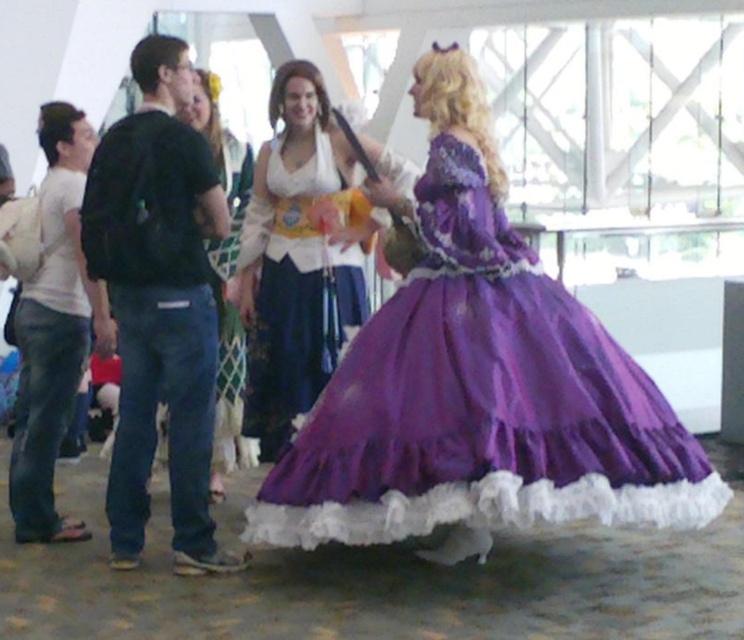
Question: Which point is closer to the camera?

Choices:
 (A) purple satin dress at center
 (B) matte white dress at center

Answer: (A)

Question: Which is farther from the matte white blouse at center?

Choices:
 (A) purple satin dress at center
 (B) matte white dress at center
 (C) matte white shirt at left

Answer: (C)

Question: Does matte white shirt at left have a larger size compared to matte white dress at center?

Choices:
 (A) yes
 (B) no

Answer: (B)

Question: Which object is closer to the camera taking this photo?

Choices:
 (A) matte white shirt at left
 (B) purple satin dress at center

Answer: (B)

Question: Is black cotton shirt at left thinner than matte white blouse at center?

Choices:
 (A) no
 (B) yes

Answer: (B)

Question: Can you confirm if purple satin dress at center is positioned to the left of matte white dress at center?

Choices:
 (A) no
 (B) yes

Answer: (A)